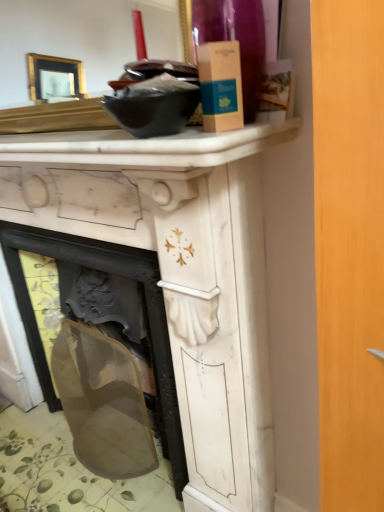
Question: Can you confirm if white marble counter top at upper center is taller than transparent plastic screen at lower left?

Choices:
 (A) yes
 (B) no

Answer: (B)

Question: From a real-world perspective, is white marble counter top at upper center positioned over transparent plastic screen at lower left based on gravity?

Choices:
 (A) yes
 (B) no

Answer: (A)

Question: From the image's perspective, is white marble counter top at upper center above transparent plastic screen at lower left?

Choices:
 (A) no
 (B) yes

Answer: (B)

Question: Considering the relative sizes of white marble counter top at upper center and transparent plastic screen at lower left in the image provided, is white marble counter top at upper center shorter than transparent plastic screen at lower left?

Choices:
 (A) no
 (B) yes

Answer: (B)

Question: Is white marble counter top at upper center outside transparent plastic screen at lower left?

Choices:
 (A) yes
 (B) no

Answer: (A)

Question: Is white marble counter top at upper center aimed at transparent plastic screen at lower left?

Choices:
 (A) no
 (B) yes

Answer: (A)

Question: Can we say white marble fireplace at center lies outside transparent plastic screen at lower left?

Choices:
 (A) yes
 (B) no

Answer: (A)

Question: Is white marble fireplace at center at the left side of transparent plastic screen at lower left?

Choices:
 (A) yes
 (B) no

Answer: (B)

Question: Is white marble fireplace at center in front of transparent plastic screen at lower left?

Choices:
 (A) no
 (B) yes

Answer: (B)

Question: Would you consider white marble fireplace at center to be distant from transparent plastic screen at lower left?

Choices:
 (A) no
 (B) yes

Answer: (A)

Question: Considering the relative sizes of white marble fireplace at center and transparent plastic screen at lower left in the image provided, is white marble fireplace at center thinner than transparent plastic screen at lower left?

Choices:
 (A) yes
 (B) no

Answer: (A)

Question: Does white marble fireplace at center turn towards transparent plastic screen at lower left?

Choices:
 (A) yes
 (B) no

Answer: (A)

Question: Is white marble counter top at upper center at the back of transparent plastic screen at lower left?

Choices:
 (A) yes
 (B) no

Answer: (B)